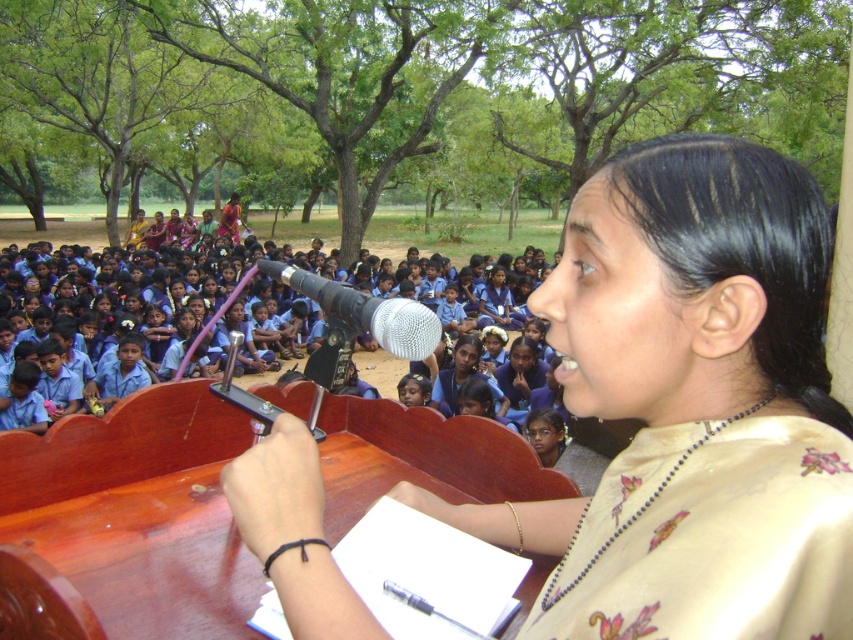
Question: Is the position of silk sari at center less distant than that of silver metallic microphone at center?

Choices:
 (A) yes
 (B) no

Answer: (A)

Question: Is silk sari at center positioned before silver metallic microphone at center?

Choices:
 (A) no
 (B) yes

Answer: (B)

Question: In this image, where is silk sari at center located relative to silver metallic microphone at center?

Choices:
 (A) right
 (B) left

Answer: (A)

Question: Which point is closer to the camera?

Choices:
 (A) silk sari at center
 (B) silver metallic microphone at center

Answer: (A)

Question: Which object is closer to the camera taking this photo?

Choices:
 (A) silk sari at center
 (B) silver metallic microphone at center

Answer: (A)

Question: Which point is closer to the camera taking this photo?

Choices:
 (A) (786, 557)
 (B) (260, 269)

Answer: (A)